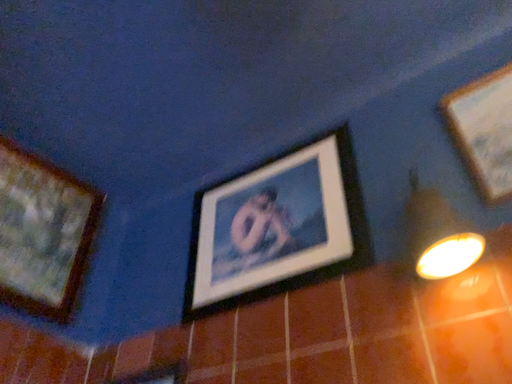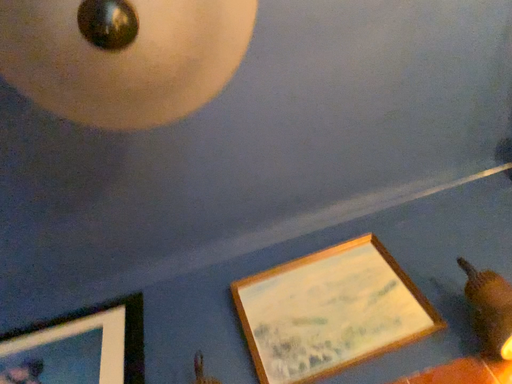
Question: How did the camera likely rotate when shooting the video?

Choices:
 (A) rotated downward
 (B) rotated upward

Answer: (B)